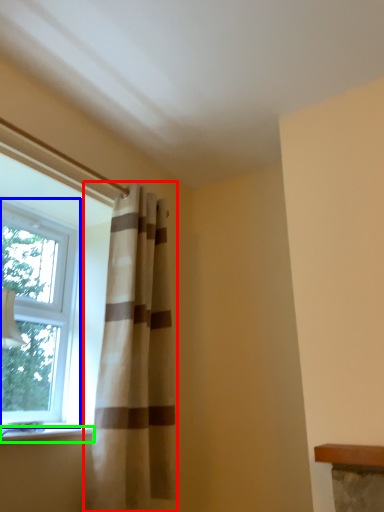
Question: Based on their relative distances, which object is nearer to curtain (highlighted by a red box)? Choose from window (highlighted by a blue box) and window sill (highlighted by a green box).

Choices:
 (A) window
 (B) window sill

Answer: (B)